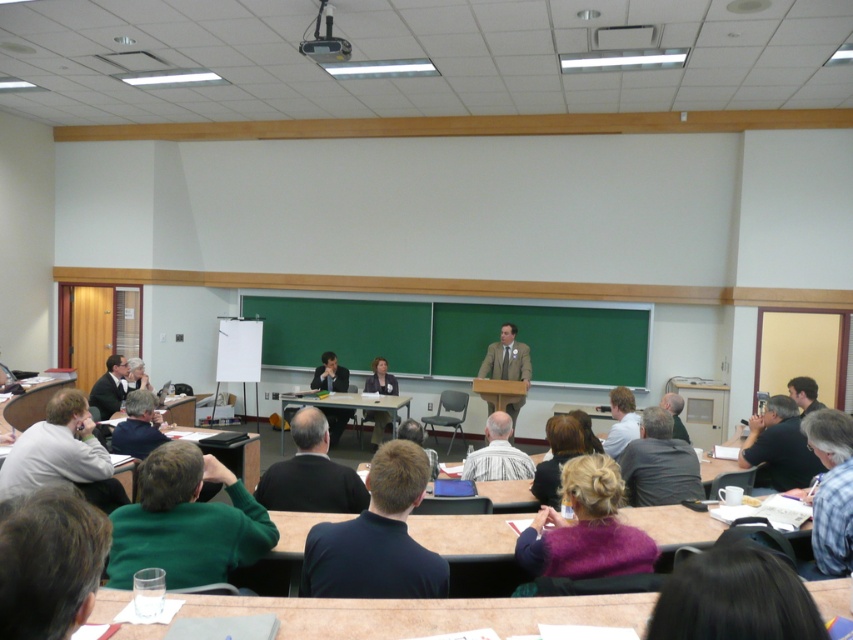
Question: Which point appears farthest from the camera in this image?

Choices:
 (A) (503, 369)
 (B) (393, 417)

Answer: (A)

Question: Does dark blue turtleneck sweater at center have a greater width compared to dark gray sweater at center?

Choices:
 (A) no
 (B) yes

Answer: (A)

Question: Which of the following is the closest to the observer?

Choices:
 (A) purple fuzzy sweater at lower center
 (B) dark blue turtleneck sweater at center

Answer: (B)

Question: Is dark gray suit at center to the right of matte black jacket at center from the viewer's perspective?

Choices:
 (A) yes
 (B) no

Answer: (A)

Question: Estimate the real-world distances between objects in this image. Which object is farther from the dark brown hair at center?

Choices:
 (A) purple fuzzy sweater at lower center
 (B) blue plaid shirt at lower right
 (C) light brown hair at center

Answer: (A)

Question: Does purple fuzzy sweater at lower center come in front of matte black suit at left?

Choices:
 (A) no
 (B) yes

Answer: (B)